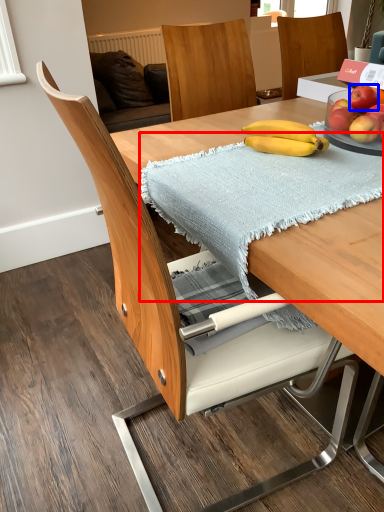
Question: Among these objects, which one is farthest to the camera, blanket (highlighted by a red box) or apple (highlighted by a blue box)?

Choices:
 (A) blanket
 (B) apple

Answer: (B)